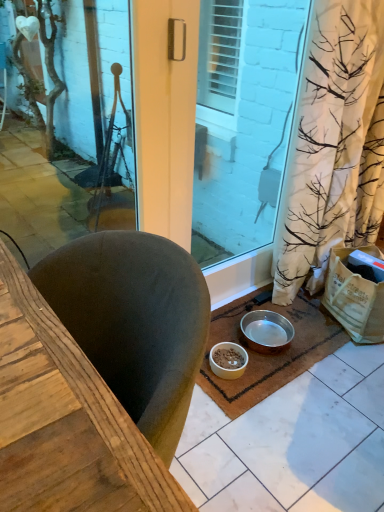
This screenshot has height=512, width=384. I want to click on free space in front of brown coir mat at lower center, so point(284,441).